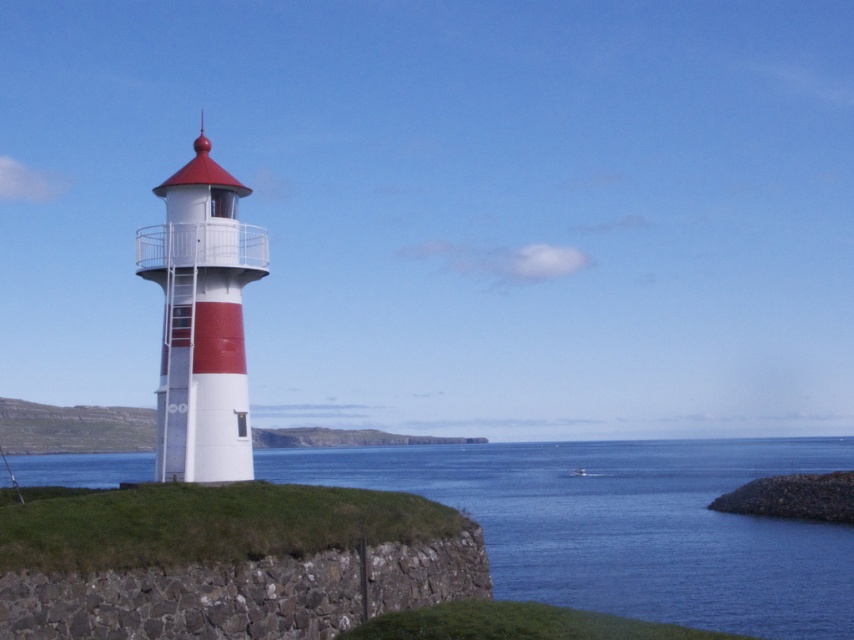
Question: Which point is farther to the camera?

Choices:
 (A) smooth white lighthouse at left
 (B) blue water at lower left
 (C) dark gray stone cliff at lower left

Answer: (B)

Question: Among these points, which one is nearest to the camera?

Choices:
 (A) (659, 570)
 (B) (139, 236)
 (C) (309, 596)

Answer: (C)

Question: Is blue water at lower left bigger than dark gray stone cliff at lower left?

Choices:
 (A) no
 (B) yes

Answer: (B)

Question: Does blue water at lower left appear on the left side of dark gray stone cliff at lower left?

Choices:
 (A) no
 (B) yes

Answer: (B)

Question: Is the position of dark gray stone cliff at lower left less distant than that of smooth white lighthouse at left?

Choices:
 (A) yes
 (B) no

Answer: (A)

Question: Which point is farther from the camera taking this photo?

Choices:
 (A) (170, 358)
 (B) (290, 612)
 (C) (355, 486)

Answer: (C)